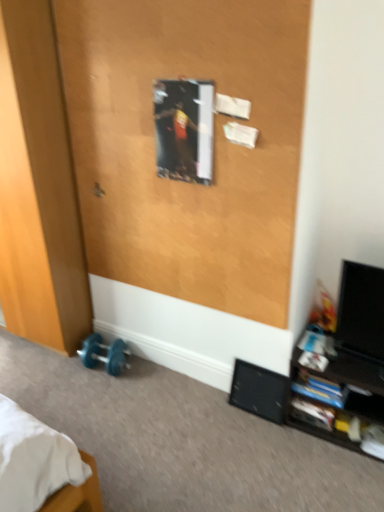
Identify the location of vacant space underneath black glossy monitor at right (from a real-world perspective). This screenshot has height=512, width=384. (355, 364).